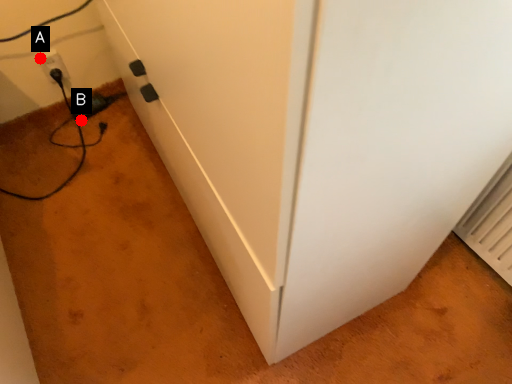
Question: Two points are circled on the image, labeled by A and B beside each circle. Which of the following is the farthest from the observer?

Choices:
 (A) A is further
 (B) B is further

Answer: (B)